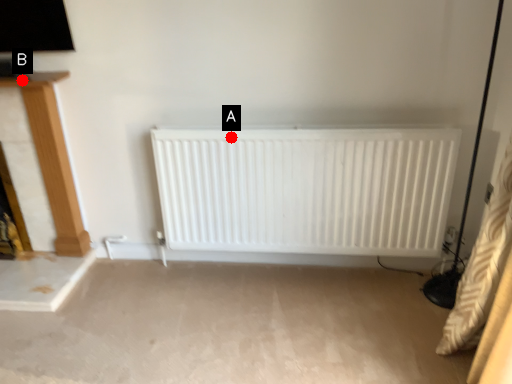
Question: Two points are circled on the image, labeled by A and B beside each circle. Which point appears farthest from the camera in this image?

Choices:
 (A) A is further
 (B) B is further

Answer: (B)